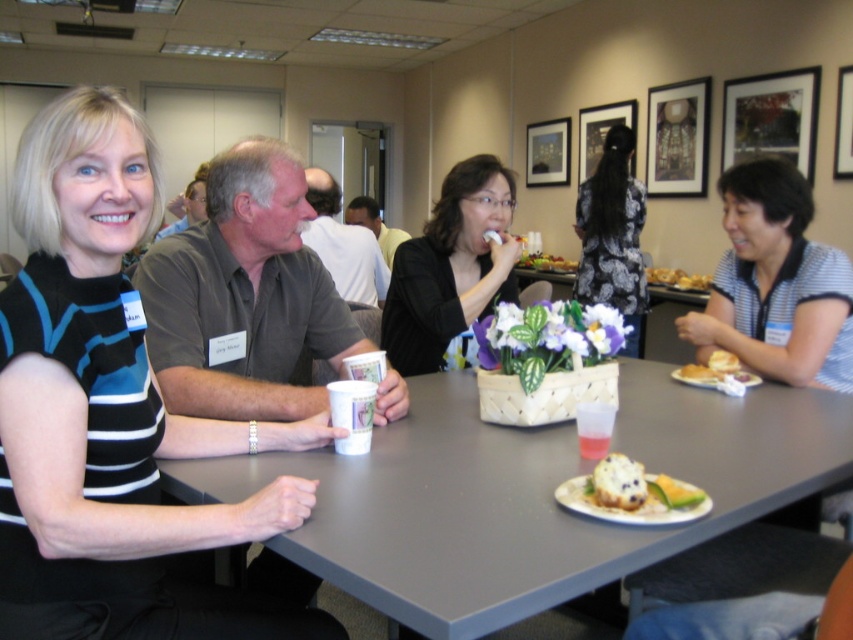
Question: Which point is closer to the camera taking this photo?

Choices:
 (A) (354, 204)
 (B) (662, 416)
 (C) (641, 289)
 (D) (474, 289)

Answer: (B)

Question: Which point is closer to the camera?

Choices:
 (A) (619, 465)
 (B) (735, 333)

Answer: (A)

Question: Is gray plastic table at center behind gray fabric shirt at center?

Choices:
 (A) yes
 (B) no

Answer: (B)

Question: Considering the relative positions of blue striped shirt at right and black matte jacket at center in the image provided, where is blue striped shirt at right located with respect to black matte jacket at center?

Choices:
 (A) left
 (B) right

Answer: (B)

Question: Considering the relative positions of yellow cake at center and matte black shirt at upper left in the image provided, where is yellow cake at center located with respect to matte black shirt at upper left?

Choices:
 (A) left
 (B) right

Answer: (B)

Question: Among these objects, which one is nearest to the camera?

Choices:
 (A) matte black shirt at upper left
 (B) black matte jacket at center
 (C) blueberry muffin at center

Answer: (C)